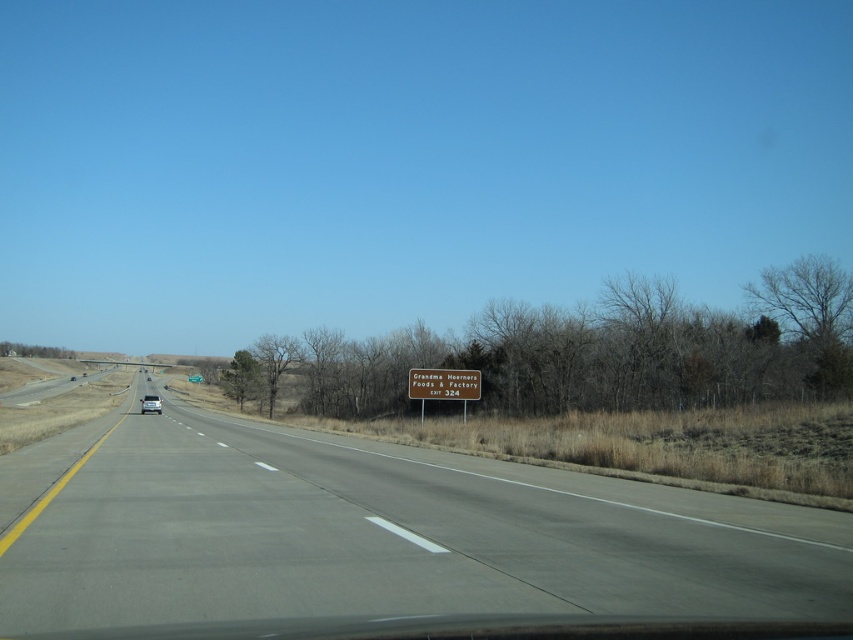
Which is more to the right, brown sign at center or brown wooden sign at center?

brown wooden sign at center

From the picture: Can you confirm if brown sign at center is positioned to the right of brown wooden sign at center?

No, brown sign at center is not to the right of brown wooden sign at center.

Is point (341, 470) closer to viewer compared to point (469, 380)?

Yes, point (341, 470) is closer to viewer.

In order to click on brown sign at center in this screenshot , I will do `click(376, 532)`.

Is point (474, 371) positioned after point (146, 401)?

No.

Does point (432, 392) come farther from viewer compared to point (158, 403)?

No, it is not.

Where is `brown wooden sign at center`? Image resolution: width=853 pixels, height=640 pixels. brown wooden sign at center is located at coordinates (444, 384).

Between point (222, 593) and point (144, 412), which one is positioned in front?

Point (222, 593) is more forward.

Who is more forward, [68,522] or [158,406]?

Point [68,522] is in front.

Locate an element on the screen. brown sign at center is located at coordinates (376, 532).